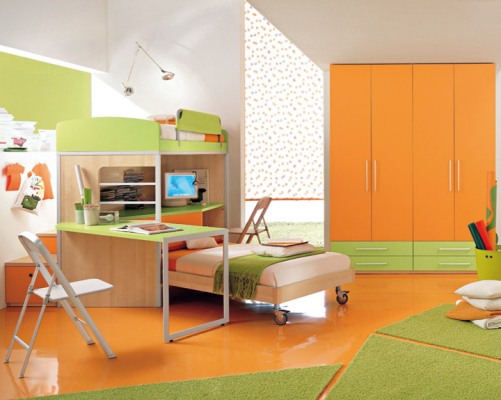
Find the location of a particular element. The image size is (501, 400). light fixture is located at coordinates (130, 93), (165, 75).